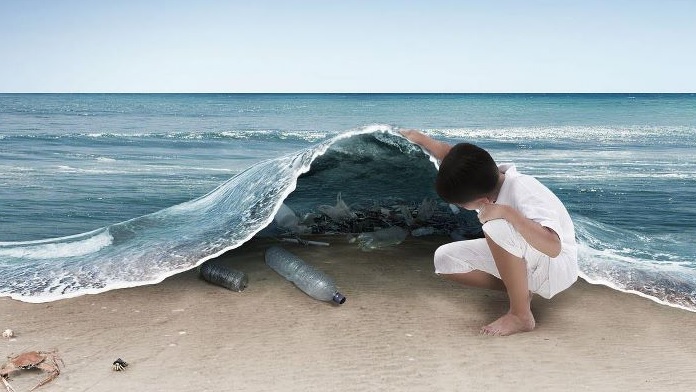
Locate an element on the screen. The image size is (696, 392). trash is located at coordinates (296, 272).